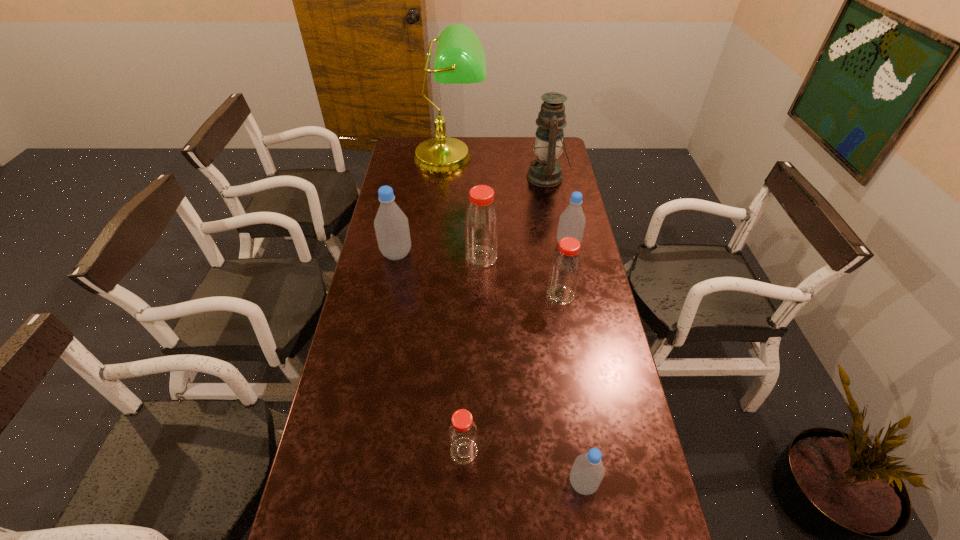
Identify the location of the second closest gray bottle relative to the leftmost bottle. (587, 472).

Identify the location of gray bottle that is the nearest to the rightmost gray bottle. (391, 225).

This screenshot has width=960, height=540. Find the location of `blank area in the image that satisfies the following two spatial constraints: 1. on the front side of the biggest red bottle; 2. on the right side of the smallest gray bottle`. blank area in the image that satisfies the following two spatial constraints: 1. on the front side of the biggest red bottle; 2. on the right side of the smallest gray bottle is located at coordinates (482, 483).

Where is `vacant point that satisfies the following two spatial constraints: 1. on the desk next to the tallest object; 2. on the right side of the second nearest red bottle`? The width and height of the screenshot is (960, 540). vacant point that satisfies the following two spatial constraints: 1. on the desk next to the tallest object; 2. on the right side of the second nearest red bottle is located at coordinates (437, 295).

I want to click on free spot that satisfies the following two spatial constraints: 1. on the front side of the rightmost gray bottle; 2. on the left side of the oil lamp, so (x=560, y=245).

Locate an element on the screen. The image size is (960, 540). free spot that satisfies the following two spatial constraints: 1. on the desk next to the tallest object; 2. on the right side of the second nearest red bottle is located at coordinates (437, 295).

The image size is (960, 540). What are the coordinates of `vacant region that satisfies the following two spatial constraints: 1. on the back side of the second tallest object; 2. on the right side of the nearest red bottle` in the screenshot? It's located at (471, 177).